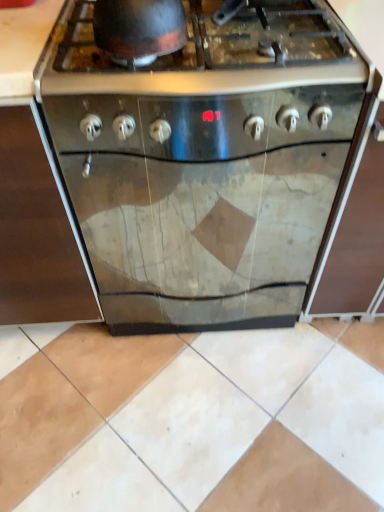
Question: Is stainless steel oven at left to the left or to the right of shiny black wok at upper center in the image?

Choices:
 (A) right
 (B) left

Answer: (B)

Question: Considering their positions, is stainless steel oven at left located in front of or behind shiny black wok at upper center?

Choices:
 (A) front
 (B) behind

Answer: (B)

Question: Which object is the closest to the stainless steel oven at center?

Choices:
 (A) shiny black wok at upper center
 (B) beige ceramic tile at lower center
 (C) stainless steel gas stove at center
 (D) stainless steel oven at left

Answer: (C)

Question: Based on their relative distances, which object is nearer to the stainless steel oven at left?

Choices:
 (A) stainless steel oven at center
 (B) beige ceramic tile at lower center
 (C) stainless steel gas stove at center
 (D) shiny black wok at upper center

Answer: (A)